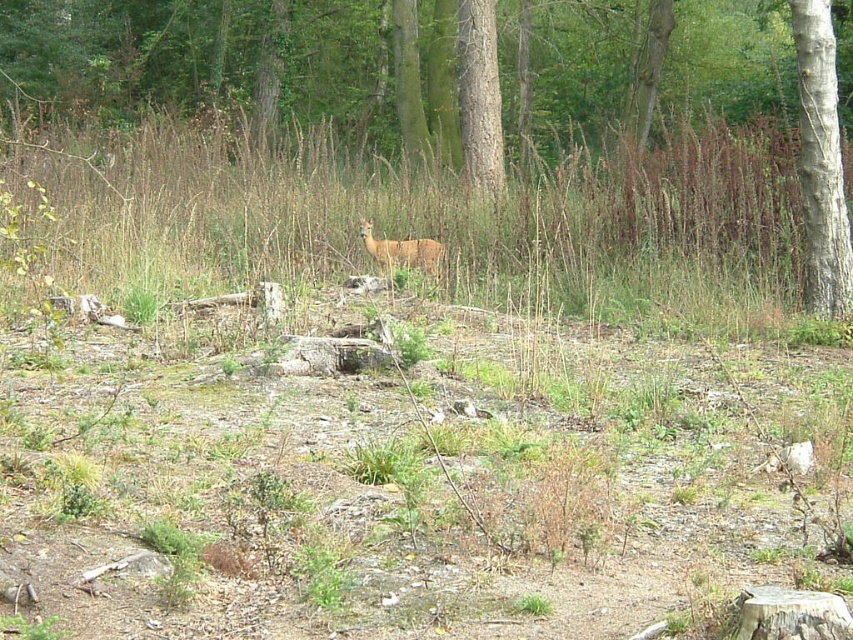
Which is in front, point (814, 272) or point (393, 253)?

Point (814, 272)

Who is lower down, brown wood tree at center or brown matte deer at center?

brown matte deer at center is lower down.

Find the location of a particular element. This screenshot has height=640, width=853. brown wood tree at center is located at coordinates (459, 134).

This screenshot has width=853, height=640. Find the location of `brown wood tree at center`. brown wood tree at center is located at coordinates (459, 134).

Can you confirm if smooth bark tree at right is bigger than brown matte deer at center?

Indeed, smooth bark tree at right has a larger size compared to brown matte deer at center.

Can you confirm if smooth bark tree at right is positioned to the left of brown matte deer at center?

Incorrect, smooth bark tree at right is not on the left side of brown matte deer at center.

Is point (805, 51) closer to viewer compared to point (399, 248)?

Yes, it is in front of point (399, 248).

Identify the location of smooth bark tree at right. This screenshot has height=640, width=853. (821, 161).

Who is more forward, (131, 16) or (834, 144)?

Positioned in front is point (834, 144).

Describe the element at coordinates (459, 134) in the screenshot. This screenshot has height=640, width=853. I see `brown wood tree at center` at that location.

Where is `brown wood tree at center`? The width and height of the screenshot is (853, 640). brown wood tree at center is located at coordinates (459, 134).